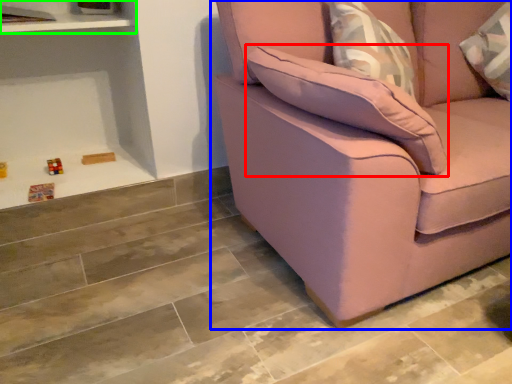
Question: Estimate the real-world distances between objects in this image. Which object is farther from pillow (highlighted by a red box), studio couch (highlighted by a blue box) or shelf (highlighted by a green box)?

Choices:
 (A) studio couch
 (B) shelf

Answer: (B)